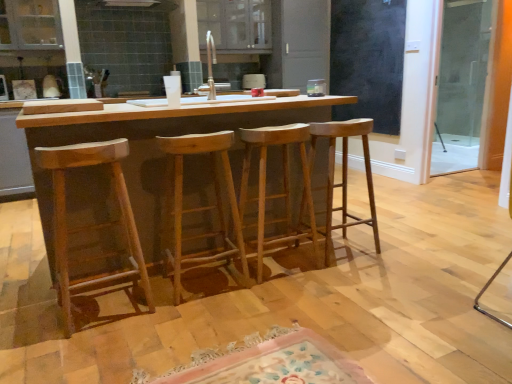
Identify the location of vacant space to the right of natural wood stool at left, the 1th stool in the left-to-right sequence. The height and width of the screenshot is (384, 512). (170, 319).